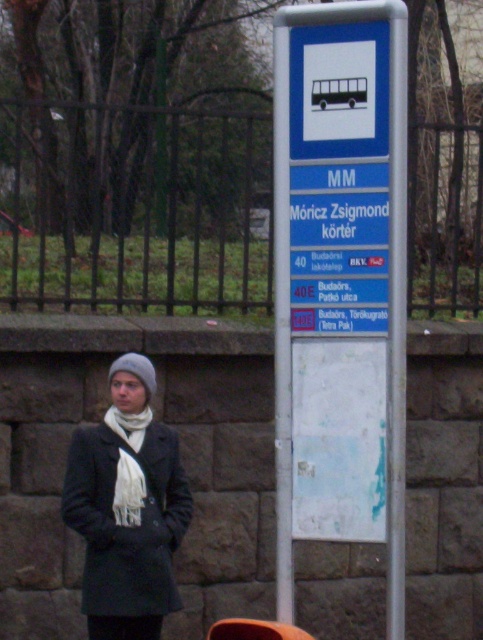
Who is taller, blue plastic bus stop sign at center or white soft scarf at lower left?

blue plastic bus stop sign at center is taller.

Who is lower down, blue plastic bus stop sign at center or white soft scarf at lower left?

Positioned lower is white soft scarf at lower left.

Is point (351, 179) behind point (109, 412)?

No, (351, 179) is closer to viewer.

Where is `blue plastic bus stop sign at center`? This screenshot has width=483, height=640. blue plastic bus stop sign at center is located at coordinates (340, 280).

Does matte black coat at center have a greater height compared to white soft scarf at lower left?

Correct, matte black coat at center is much taller as white soft scarf at lower left.

Who is taller, matte black coat at center or white soft scarf at lower left?

With more height is matte black coat at center.

Where is `matte black coat at center`? matte black coat at center is located at coordinates [127, 508].

Is matte black coat at center above white soft scarf at center?

Actually, matte black coat at center is below white soft scarf at center.

The image size is (483, 640). Identify the location of matte black coat at center. (127, 508).